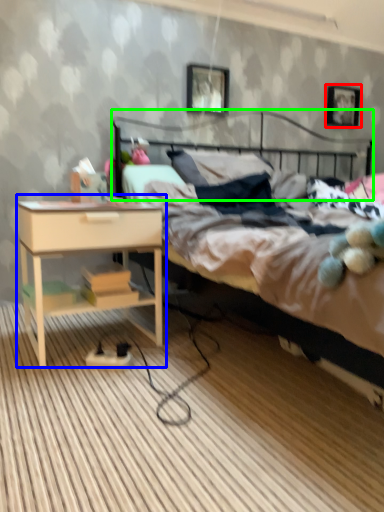
Question: Estimate the real-world distances between objects in this image. Which object is closer to picture frame (highlighted by a red box), nightstand (highlighted by a blue box) or headboard (highlighted by a green box)?

Choices:
 (A) nightstand
 (B) headboard

Answer: (B)